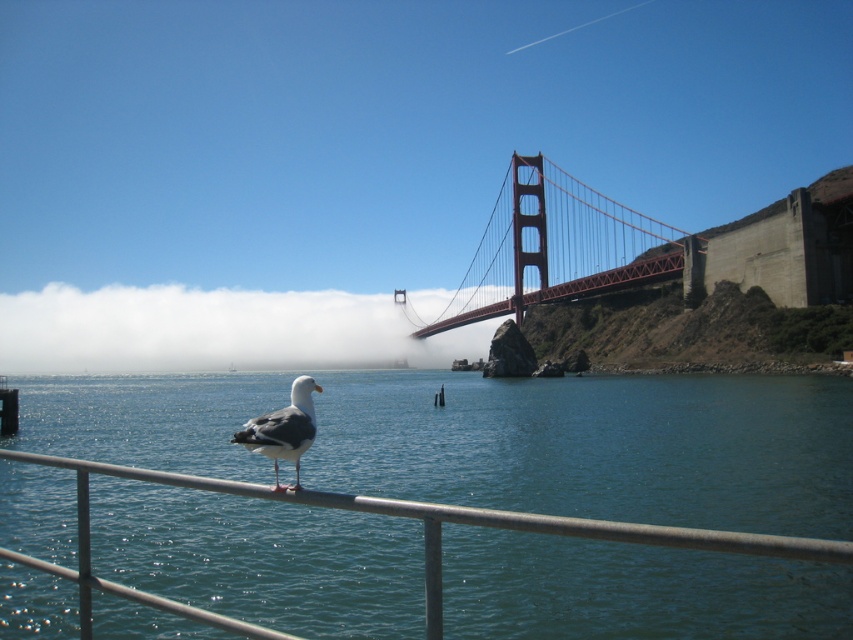
Question: Which point is closer to the camera taking this photo?

Choices:
 (A) (549, 273)
 (B) (260, 440)
 (C) (123, 369)

Answer: (B)

Question: Which object appears closest to the camera in this image?

Choices:
 (A) white misty fog at center
 (B) white feathered bird at center

Answer: (B)

Question: Is white misty fog at center smaller than red painted steel golden gate bridge at center?

Choices:
 (A) yes
 (B) no

Answer: (B)

Question: Which object appears closest to the camera in this image?

Choices:
 (A) white misty fog at center
 (B) blue water at center

Answer: (B)

Question: Can you confirm if blue water at center is thinner than red painted steel golden gate bridge at center?

Choices:
 (A) yes
 (B) no

Answer: (B)

Question: Is blue water at center smaller than red painted steel golden gate bridge at center?

Choices:
 (A) no
 (B) yes

Answer: (B)